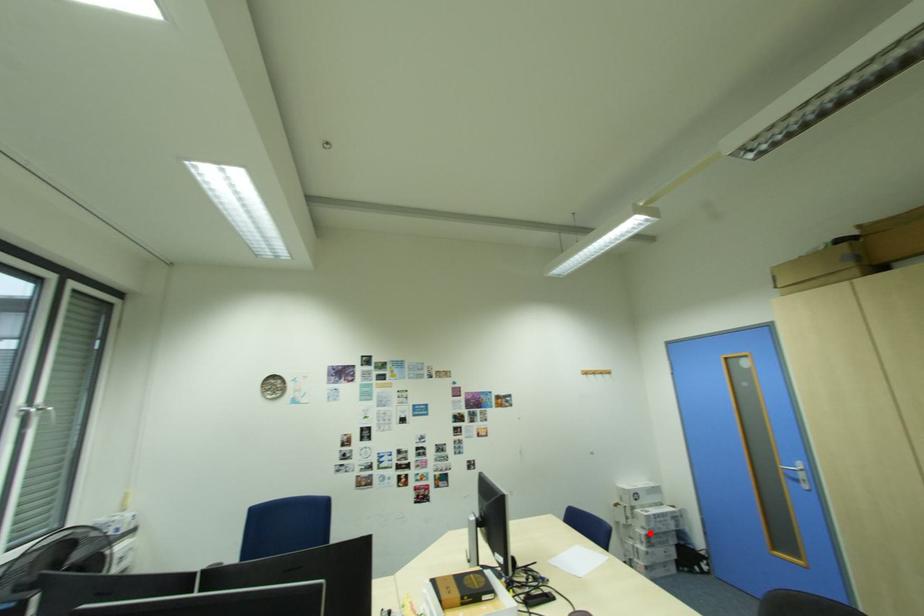
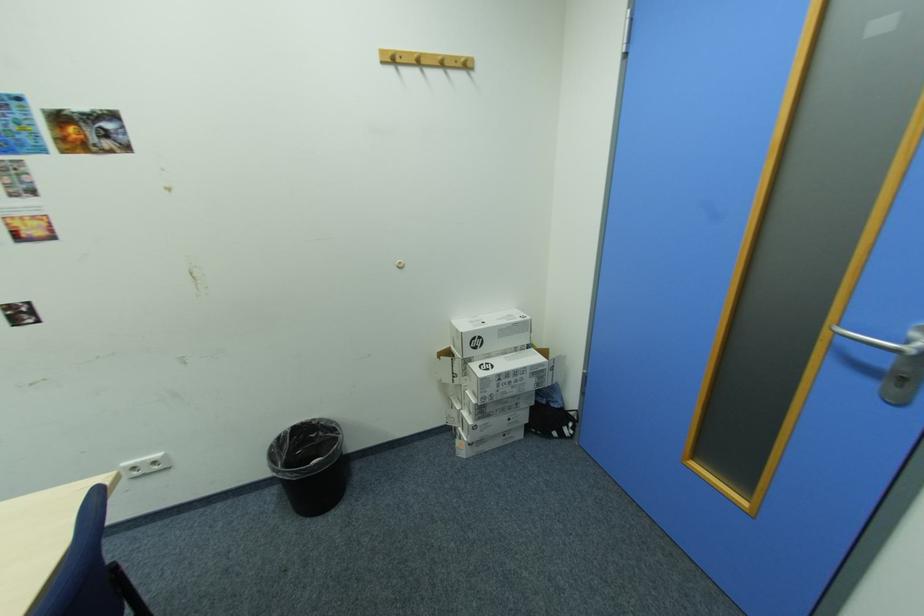
Question: I am providing you with two images of the same scene from different viewpoints. A red point is marked on the first image. At the location where the point appears in image 1, is it still visible in image 2?

Choices:
 (A) Yes
 (B) No

Answer: (A)